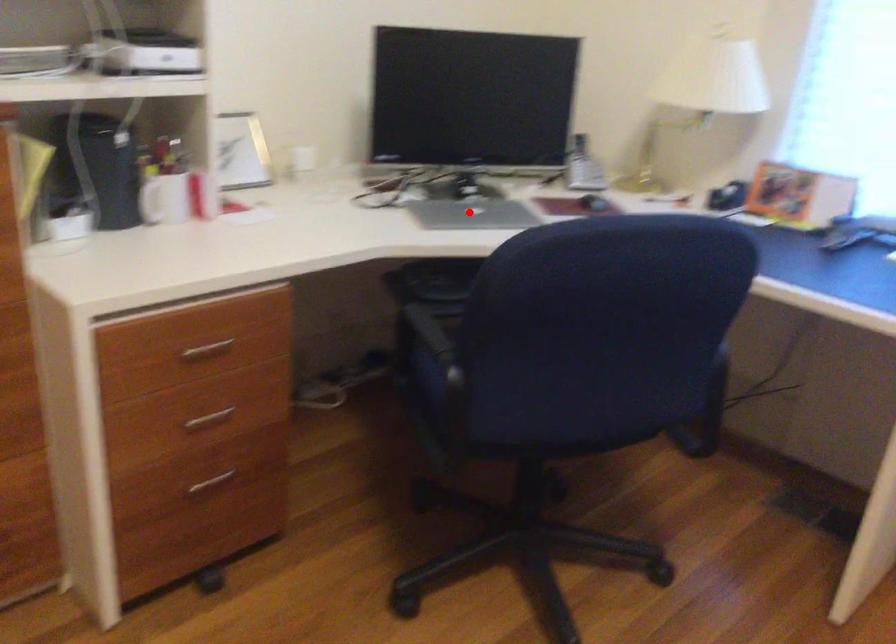
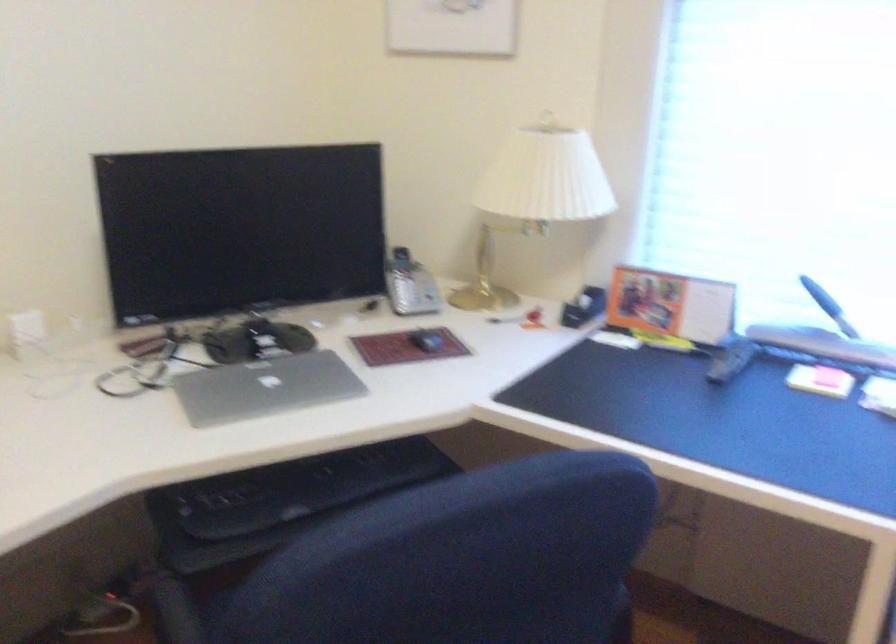
Question: I am providing you with two images of the same scene from different viewpoints. In image1, a red point is highlighted. Considering the same 3D point in image2, which of the following is correct?

Choices:
 (A) It is closer
 (B) It is farther

Answer: (A)